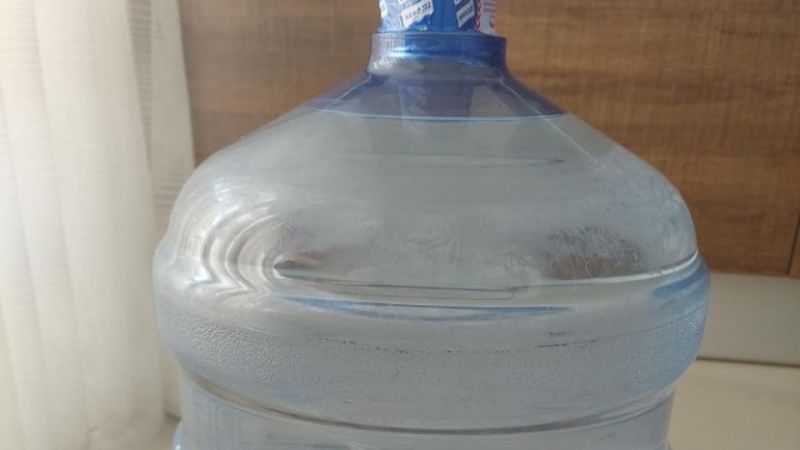
Image resolution: width=800 pixels, height=450 pixels. I want to click on curtain, so click(x=86, y=154).